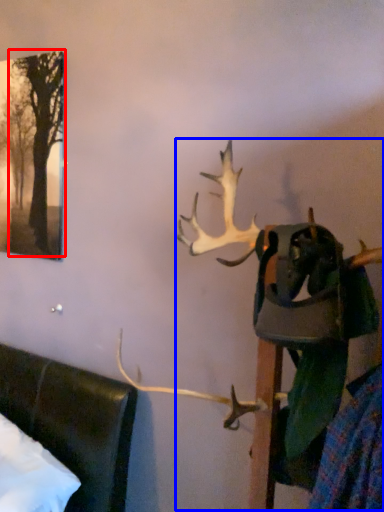
Question: Which of the following is the closest to the observer, tree (highlighted by a red box) or deer (highlighted by a blue box)?

Choices:
 (A) tree
 (B) deer

Answer: (B)